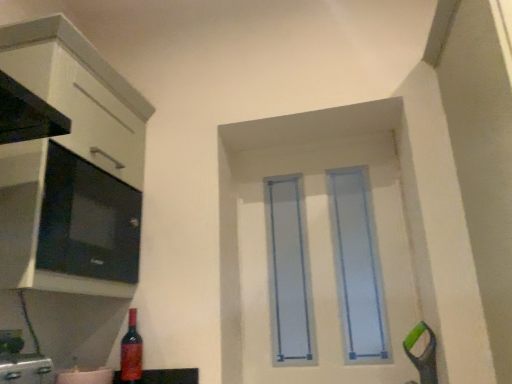
Question: From a real-world perspective, is light blue plastic door at center located higher than white glossy cabinet at left?

Choices:
 (A) yes
 (B) no

Answer: (B)

Question: Is light blue plastic door at center in front of white glossy cabinet at left?

Choices:
 (A) yes
 (B) no

Answer: (B)

Question: Is light blue plastic door at center with white glossy cabinet at left?

Choices:
 (A) no
 (B) yes

Answer: (A)

Question: Considering the relative positions of light blue plastic door at center and white glossy cabinet at left in the image provided, is light blue plastic door at center to the right of white glossy cabinet at left from the viewer's perspective?

Choices:
 (A) no
 (B) yes

Answer: (B)

Question: Does light blue plastic door at center have a lesser height compared to white glossy cabinet at left?

Choices:
 (A) yes
 (B) no

Answer: (B)

Question: Is light blue plastic door at center facing away from white glossy cabinet at left?

Choices:
 (A) yes
 (B) no

Answer: (B)

Question: Is white glossy cabinet at left not close to matte black microwave at left?

Choices:
 (A) no
 (B) yes

Answer: (A)

Question: Does white glossy cabinet at left have a lesser height compared to matte black microwave at left?

Choices:
 (A) yes
 (B) no

Answer: (B)

Question: Does white glossy cabinet at left appear on the right side of matte black microwave at left?

Choices:
 (A) yes
 (B) no

Answer: (A)

Question: Is white glossy cabinet at left facing away from matte black microwave at left?

Choices:
 (A) yes
 (B) no

Answer: (A)

Question: Can you confirm if white glossy cabinet at left is smaller than matte black microwave at left?

Choices:
 (A) no
 (B) yes

Answer: (A)

Question: From a real-world perspective, is white glossy cabinet at left positioned over matte black microwave at left based on gravity?

Choices:
 (A) yes
 (B) no

Answer: (A)

Question: Is the depth of light blue plastic door at center greater than that of shiny red glass bottle at lower left?

Choices:
 (A) no
 (B) yes

Answer: (B)